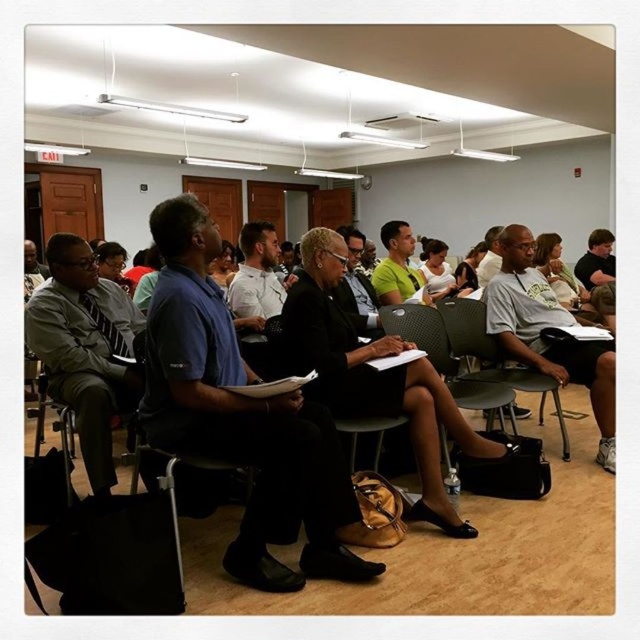
Question: Among these objects, which one is farthest from the camera?

Choices:
 (A) gray plastic chair at center
 (B) matte gray suit at left

Answer: (A)

Question: Can you confirm if blue fabric shirt at center is bigger than gray plastic chair at center?

Choices:
 (A) yes
 (B) no

Answer: (B)

Question: Considering the relative positions of green fabric chair at center and gray plastic chair at center in the image provided, where is green fabric chair at center located with respect to gray plastic chair at center?

Choices:
 (A) right
 (B) left

Answer: (B)

Question: Which of the following is the farthest from the observer?

Choices:
 (A) (356, 312)
 (B) (481, 326)
 (C) (378, 417)

Answer: (A)

Question: Can you confirm if matte gray suit at left is positioned above green fabric chair at center?

Choices:
 (A) yes
 (B) no

Answer: (A)

Question: Which of these objects is positioned closest to the blue fabric shirt at center?

Choices:
 (A) matte gray suit at left
 (B) white cotton shirt at center

Answer: (A)